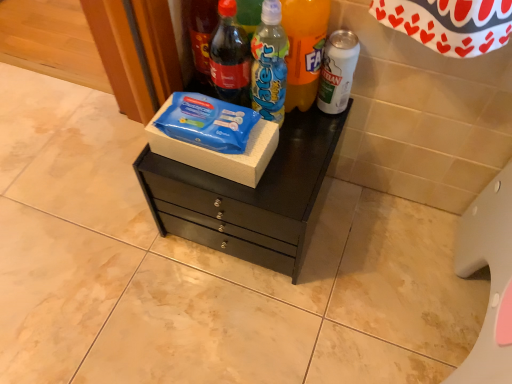
Locate an element on the screen. This screenshot has height=384, width=512. vacant area that is in front of translucent plastic water bottle at center, the second bottle viewed from the right is located at coordinates (293, 159).